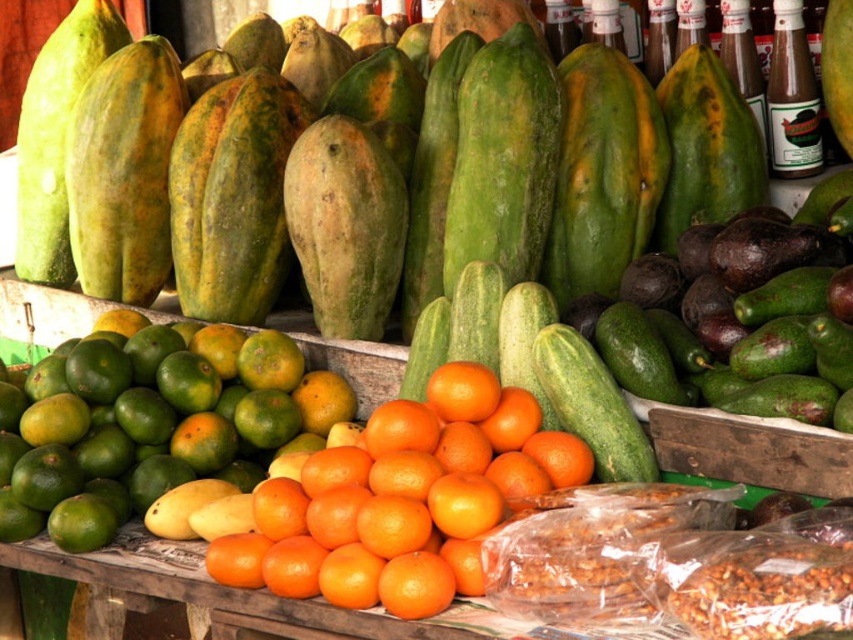
You are a customer at a market stall looking at the vibrant display of fresh produce. You see a point marked at coordinates (402, 499). Which object from the scene does this point correspond to?

The point at coordinates (402, 499) corresponds to the orangesmoothorange at center.

Looking at this image, you are a customer at the market stall and want to buy the larger fruit between the green matte mangoes at center and the orangesmoothorange at center. Which one should you choose?

The green matte mangoes at center is bigger than orangesmoothorange at center, so you should choose the green matte mangoes at center.